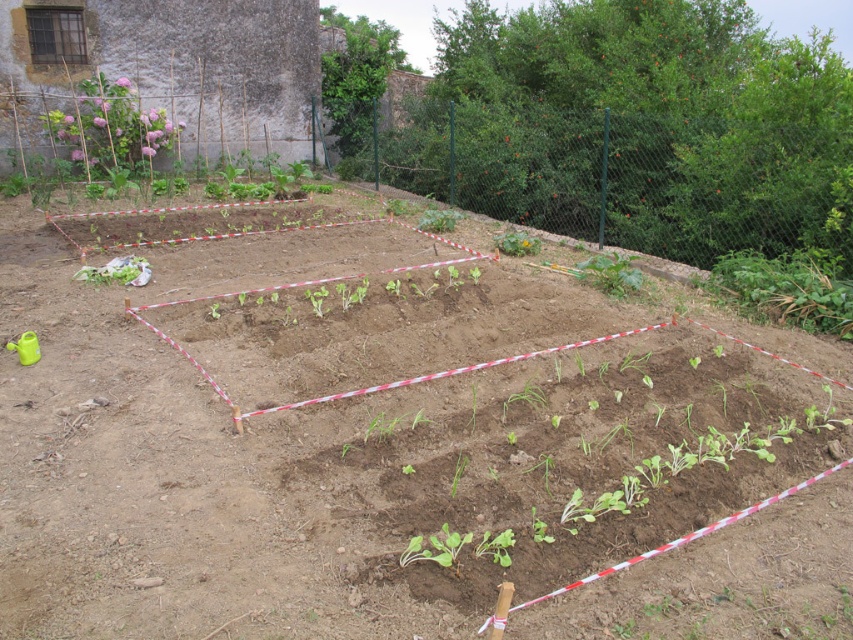
In the scene shown: You are standing at the center of the garden plot. There is a green leafy plant at upper right marked by point [788,288]. Which direction should you walk to reach it?

The green leafy plant at upper right marked by point [788,288] is located to the upper right direction from your current position at the center of the garden plot. You should walk towards the upper right direction to reach it.

You are a gardener who needs to water the plants in the garden. You have a watering can that can hold enough water to cover a 3 meter radius. Starting from the green leafy plant at upper right, can you water the green leafy plant at center without moving the watering can?

The distance between the green leafy plant at upper right and the green leafy plant at center is 4.48 meters. Since the watering can covers a 3 meter radius, the distance is greater than the coverage area. Therefore, you cannot water the green leafy plant at center from the green leafy plant at upper right without moving the watering can.